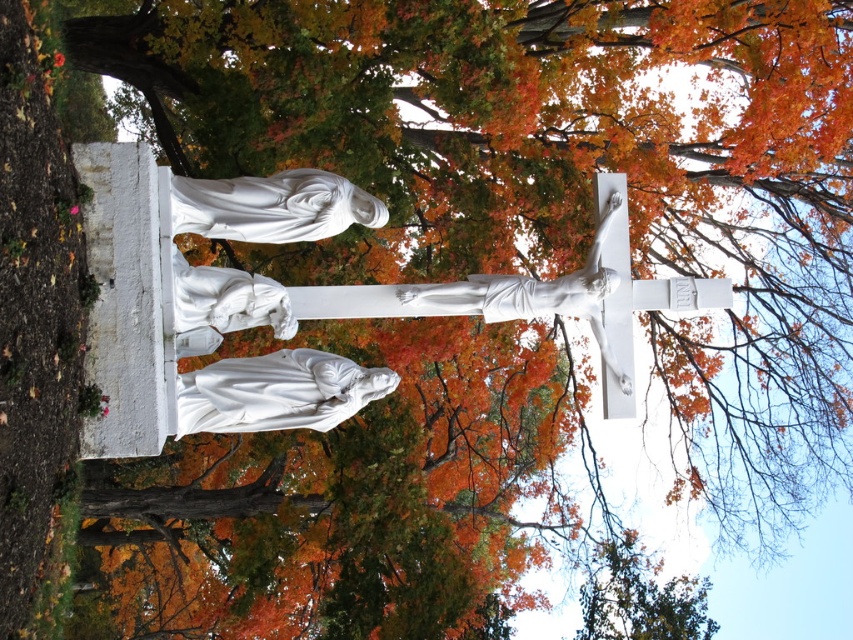
You are a GUI agent. You are given a task and a screenshot of the screen. Output one action in this format:
    pyautogui.click(x=<x>, y=<y>)
    Task: Click on the white marble statue at upper left
    This screenshot has height=640, width=853.
    Given the screenshot: What is the action you would take?
    pyautogui.click(x=271, y=205)

Can you confirm if white marble statue at upper left is thinner than white marble crucifix at upper center?

Yes.

Can you confirm if white marble statue at upper left is positioned to the right of white marble crucifix at upper center?

Incorrect, white marble statue at upper left is not on the right side of white marble crucifix at upper center.

Who is more forward, (312, 211) or (596, 234)?

Positioned in front is point (312, 211).

Locate an element on the screen. This screenshot has width=853, height=640. white marble statue at upper left is located at coordinates (271, 205).

Does white marble statue at lower center have a smaller size compared to white marble statue at upper left?

Actually, white marble statue at lower center might be larger than white marble statue at upper left.

At what (x,y) coordinates should I click in order to perform the action: click on white marble statue at lower center. Please return your answer as a coordinate pair (x, y). Looking at the image, I should click on (277, 392).